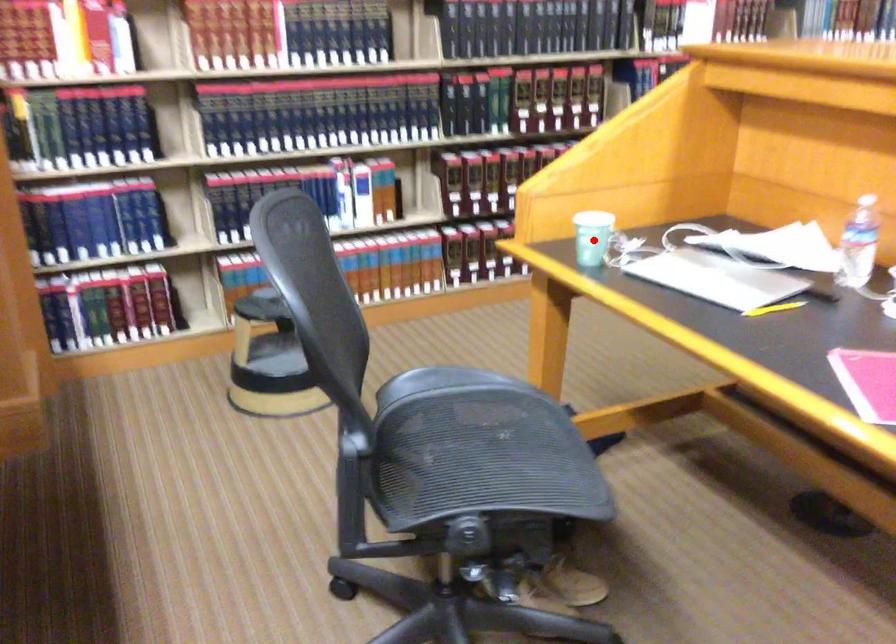
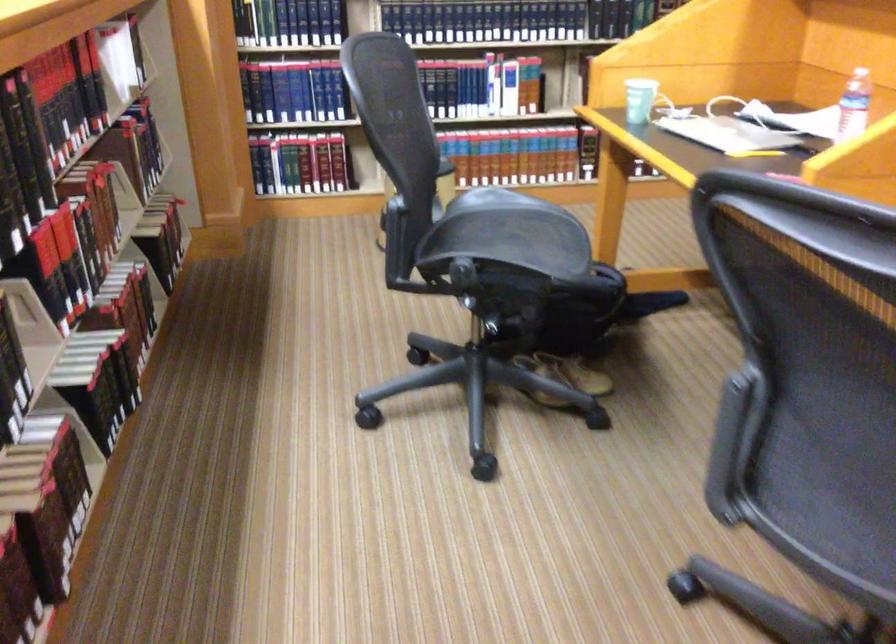
Question: I am providing you with two images of the same scene from different viewpoints. A red point is shown in image1. For the corresponding object point in image2, is it positioned nearer or farther from the camera?

Choices:
 (A) Nearer
 (B) Farther

Answer: (B)